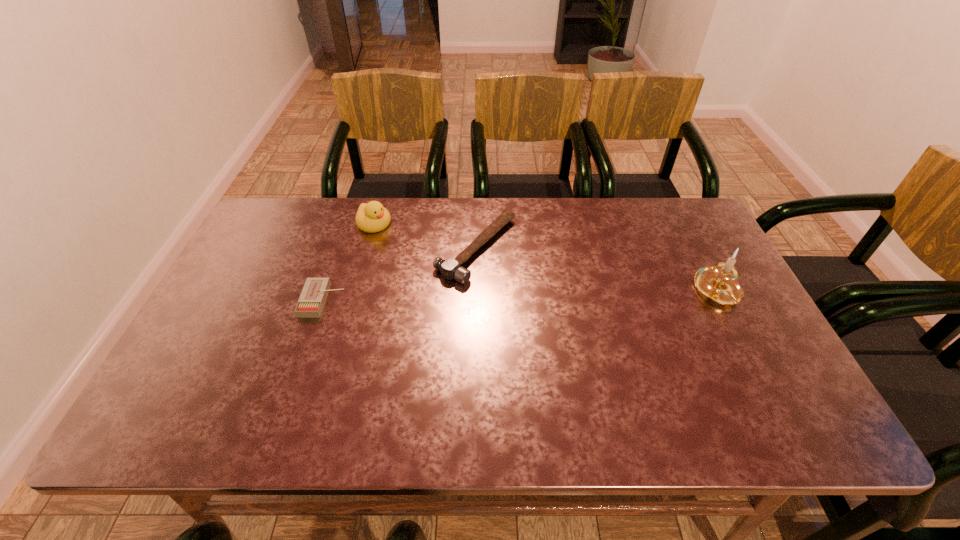
You are a GUI agent. You are given a task and a screenshot of the screen. Output one action in this format:
    pyautogui.click(x=<x>, y=<y>)
    Task: Click on the vacant space located 0.270m on the face of the duckling
    The height and width of the screenshot is (540, 960).
    Given the screenshot: What is the action you would take?
    pyautogui.click(x=440, y=274)

What are the coordinates of `vacant space located on the face of the duckling` in the screenshot? It's located at (394, 238).

Identify the location of free region located 0.180m on the face of the duckling. This screenshot has width=960, height=540. (420, 259).

Where is `hammer positioned at the far edge`? This screenshot has width=960, height=540. hammer positioned at the far edge is located at coordinates (449, 268).

Find the location of a particular element. The image size is (960, 540). duckling at the far edge is located at coordinates (371, 217).

What are the coordinates of `object located at the right edge` in the screenshot? It's located at (718, 283).

The width and height of the screenshot is (960, 540). In order to click on vacant space at the far edge in this screenshot , I will do `click(539, 212)`.

In the image, there is a desktop. What are the coordinates of `free space at the near edge` in the screenshot? It's located at (616, 394).

The height and width of the screenshot is (540, 960). Identify the location of free space at the right edge of the desktop. (708, 252).

You are a GUI agent. You are given a task and a screenshot of the screen. Output one action in this format:
    pyautogui.click(x=<x>, y=<y>)
    Task: Click on the vacant space at the far left corner of the desktop
    This screenshot has height=540, width=960.
    Given the screenshot: What is the action you would take?
    pyautogui.click(x=303, y=216)